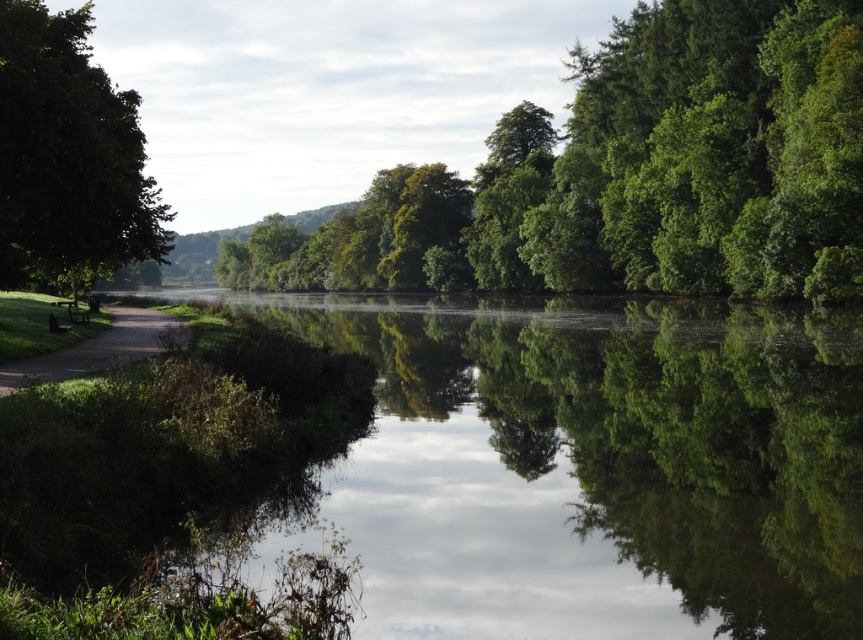
Is green grassy path at left positioned behind wooden park bench at left?

That is False.

Looking at this image, who is positioned more to the right, green grassy path at left or wooden park bench at left?

green grassy path at left

Between point (16, 374) and point (74, 317), which one is positioned behind?

Point (74, 317)

This screenshot has width=863, height=640. In order to click on green grassy path at left in this screenshot , I will do `click(95, 349)`.

Does green leafy tree at center have a lesser width compared to green leafy tree at left?

In fact, green leafy tree at center might be wider than green leafy tree at left.

Does green leafy tree at center have a larger size compared to green leafy tree at left?

Correct, green leafy tree at center is larger in size than green leafy tree at left.

Locate an element on the screen. This screenshot has width=863, height=640. green leafy tree at center is located at coordinates (630, 173).

Is point (665, 486) positioned before point (74, 321)?

Yes.

Between green reflective water at center and wooden park bench at left, which one is positioned higher?

wooden park bench at left is above.

Does point (770, 417) come in front of point (82, 308)?

That is True.

Where is `green reflective water at center`? green reflective water at center is located at coordinates (597, 465).